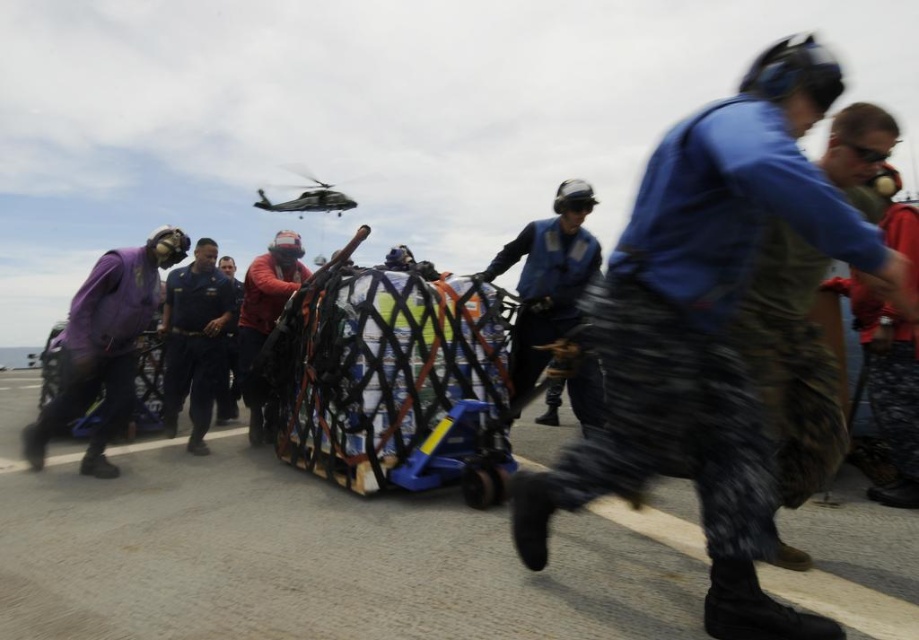
Is purple fabric at left to the left of blue fabric vest at center from the viewer's perspective?

Correct, you'll find purple fabric at left to the left of blue fabric vest at center.

Is purple fabric at left to the right of blue fabric vest at center from the viewer's perspective?

Incorrect, purple fabric at left is not on the right side of blue fabric vest at center.

Who is more distant from viewer, [108,339] or [575,214]?

Positioned behind is point [575,214].

Find the location of a particular element. Image resolution: width=919 pixels, height=640 pixels. purple fabric at left is located at coordinates (105, 346).

Is purple fabric at left to the left of red fabric bag at center from the viewer's perspective?

Yes, purple fabric at left is to the left of red fabric bag at center.

Can you confirm if purple fabric at left is shorter than red fabric bag at center?

Correct, purple fabric at left is not as tall as red fabric bag at center.

What do you see at coordinates (105, 346) in the screenshot? I see `purple fabric at left` at bounding box center [105, 346].

Find the location of a particular element. purple fabric at left is located at coordinates (105, 346).

Between camo fabric uniform at center and blue uniform at center, which one is positioned higher?

Positioned higher is camo fabric uniform at center.

Can you confirm if camo fabric uniform at center is bigger than blue uniform at center?

Incorrect, camo fabric uniform at center is not larger than blue uniform at center.

Does point (830, 70) come behind point (172, 314)?

No.

You are a GUI agent. You are given a task and a screenshot of the screen. Output one action in this format:
    pyautogui.click(x=<x>, y=<y>)
    Task: Click on the camo fabric uniform at center
    This screenshot has width=919, height=640.
    Given the screenshot: What is the action you would take?
    pyautogui.click(x=707, y=330)